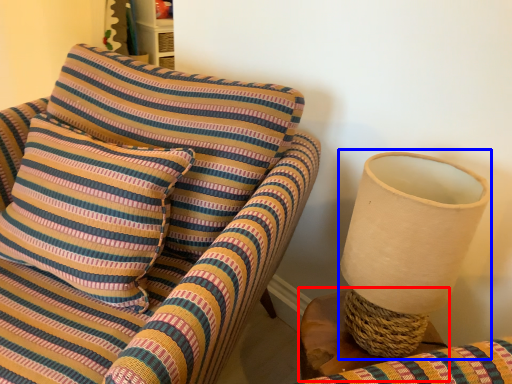
Question: Which of the following is the farthest to the observer, table (highlighted by a red box) or table lamp (highlighted by a blue box)?

Choices:
 (A) table
 (B) table lamp

Answer: (A)